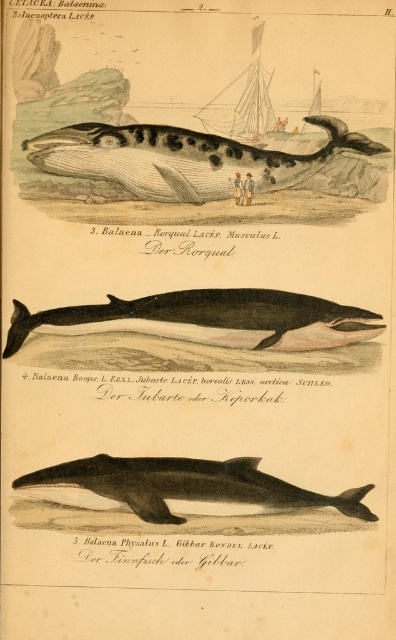
What are the coordinates of the speckled gray whale at center?

The speckled gray whale at center is located at coordinates point (207, 161).

You are a marine biologist observing the illustration. You notice a smooth gray dolphin at center and a wooden sailboat at upper center. Which object is wider in the illustration?

The smooth gray dolphin at center is wider than the wooden sailboat at upper center in the illustration.